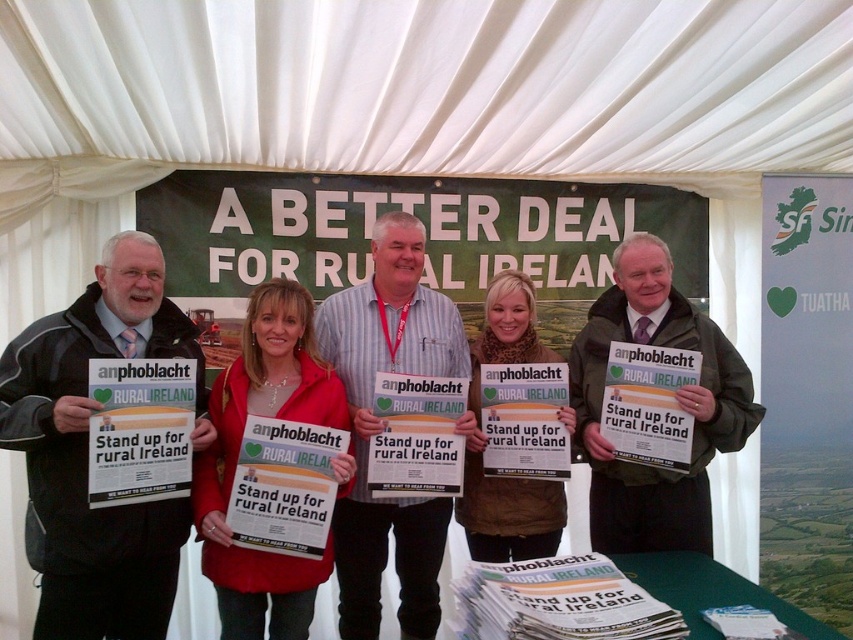
Question: Which point appears closest to the camera in this image?

Choices:
 (A) (495, 536)
 (B) (50, 497)

Answer: (B)

Question: Does striped shirt at center appear under green fabric jacket at center?

Choices:
 (A) no
 (B) yes

Answer: (B)

Question: Which is farther from the red jacket at center?

Choices:
 (A) green fabric jacket at center
 (B) black jacket at left
 (C) striped shirt at center

Answer: (A)

Question: Estimate the real-world distances between objects in this image. Which object is farther from the black jacket at left?

Choices:
 (A) brown woolen scarf at center
 (B) striped shirt at center
 (C) red jacket at center
 (D) green fabric jacket at center

Answer: (D)

Question: In this image, where is black jacket at left located relative to green fabric jacket at center?

Choices:
 (A) below
 (B) above

Answer: (A)

Question: Does green fabric jacket at center lie behind brown woolen scarf at center?

Choices:
 (A) yes
 (B) no

Answer: (B)